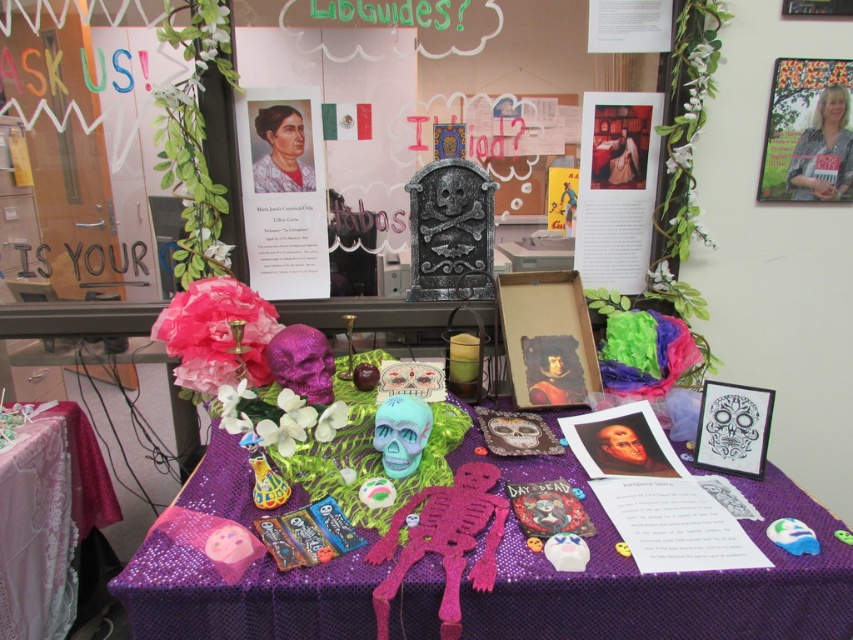
You are an event organizer setting up a display for an art exhibition. You have two matte paper items to place on the table covered with a purple sequined tablecloth. The items are the matte paper portrait at upper center and the matte paper poster at upper center. Which of these two items has a greater width?

The matte paper portrait at upper center has a greater width than the matte paper poster at upper center.

You are standing in front of the table and want to take a photo of both the matte paper portrait at upper center and the matte paper poster at upper center. Which one will appear larger in your photo?

The matte paper portrait at upper center will appear larger in the photo because it is closer to the viewer than the matte paper poster at upper center.